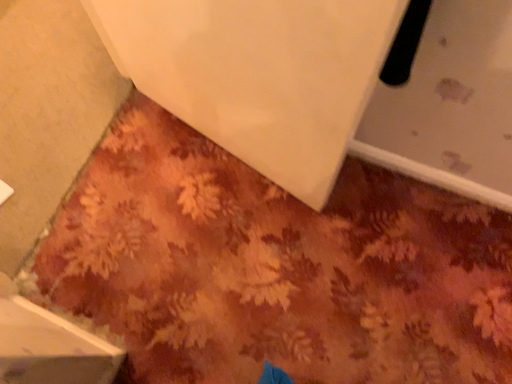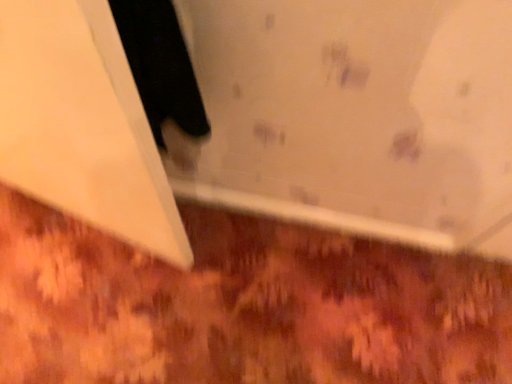
Question: How did the camera likely rotate when shooting the video?

Choices:
 (A) rotated upward
 (B) rotated downward

Answer: (A)